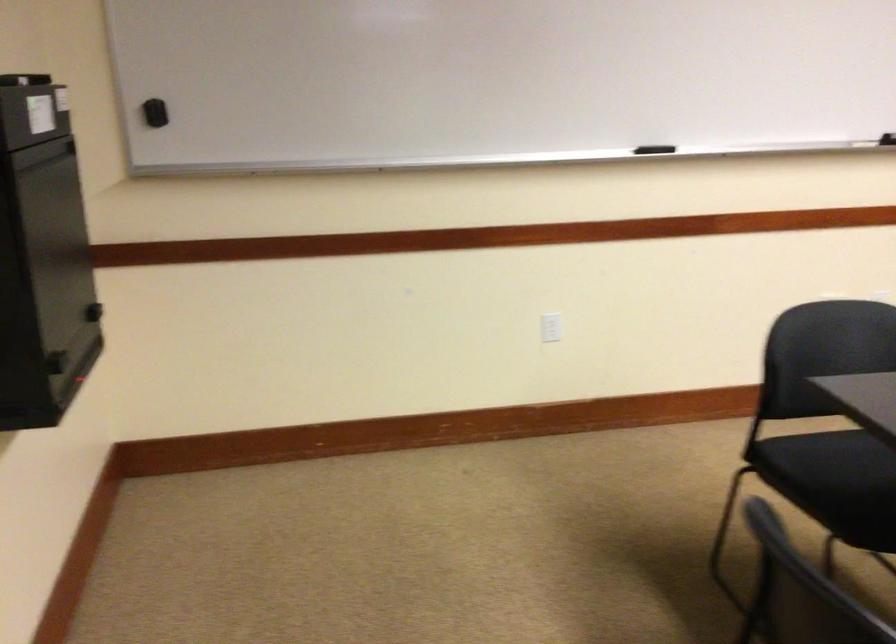
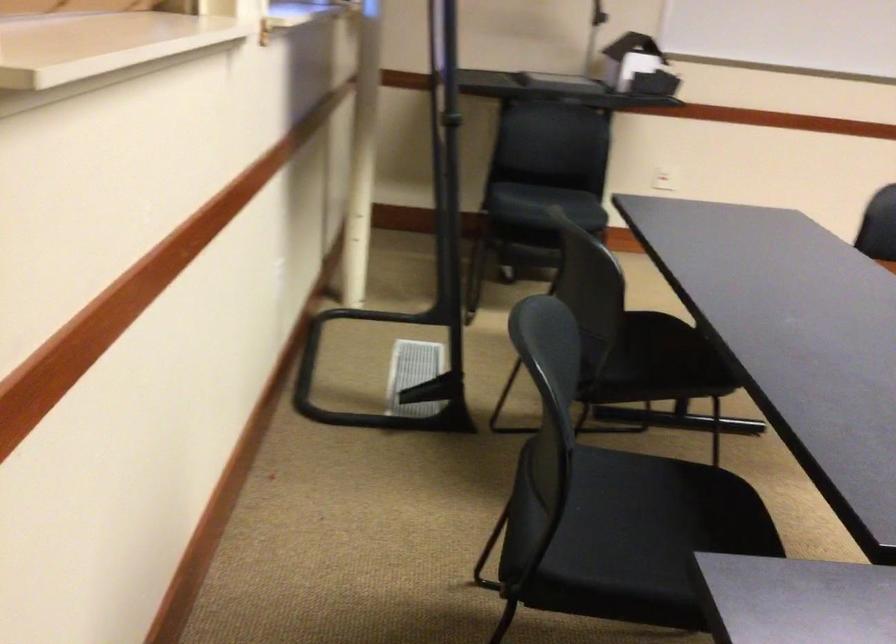
Question: The images are taken continuously from a first-person perspective. In which direction are you moving?

Choices:
 (A) Left
 (B) Right
 (C) Forward
 (D) Backward

Answer: (D)